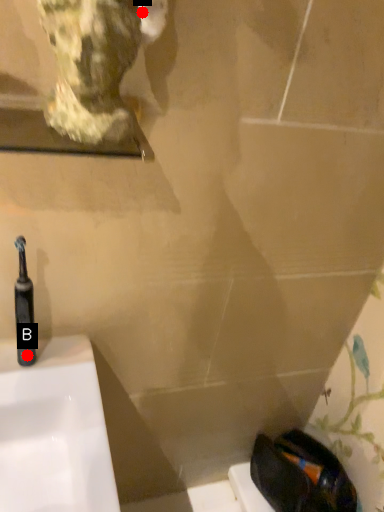
Question: Two points are circled on the image, labeled by A and B beside each circle. Among these points, which one is nearest to the camera?

Choices:
 (A) A is closer
 (B) B is closer

Answer: (A)